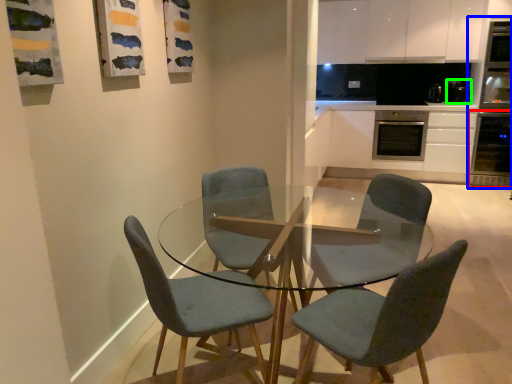
Question: Based on their relative distances, which object is nearer to oven (highlighted by a red box)? Choose from appliance (highlighted by a blue box) and appliance (highlighted by a green box).

Choices:
 (A) appliance
 (B) appliance

Answer: (A)